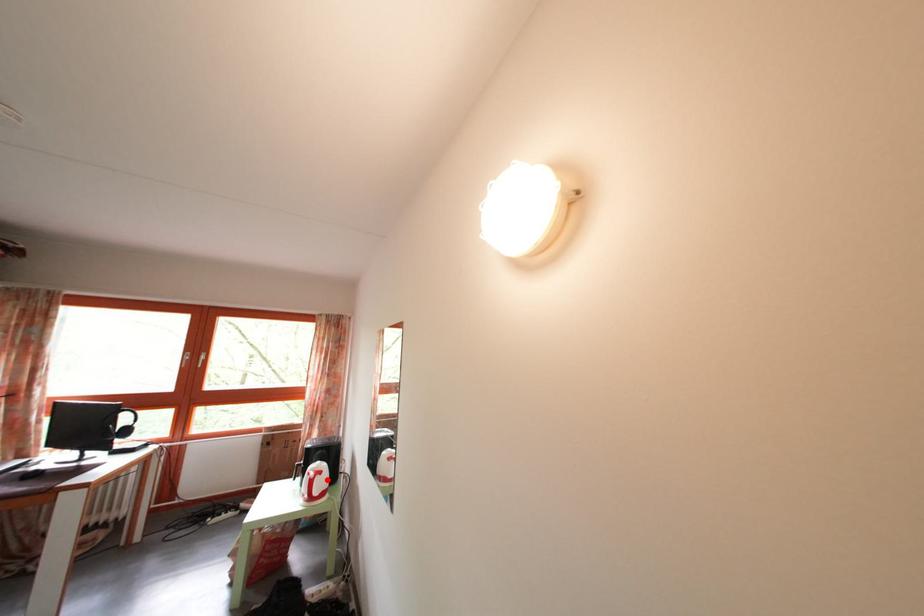
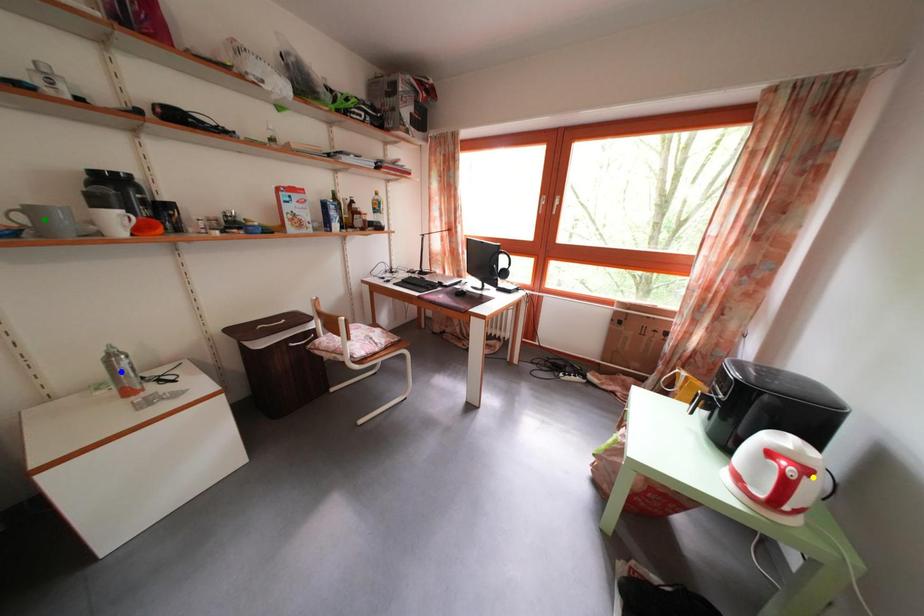
Question: I am providing you with two images of the same scene from different viewpoints. A red point is marked on the first image. You are given multiple points on the second image. In image 2, which mark is for the same physical point as the one in image 1?

Choices:
 (A) green point
 (B) blue point
 (C) yellow point

Answer: (C)